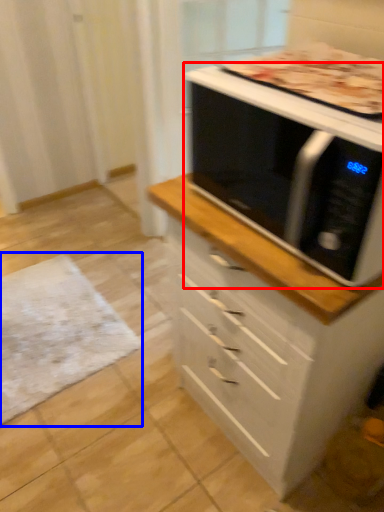
Question: Which object appears closest to the camera in this image, microwave oven (highlighted by a red box) or mat (highlighted by a blue box)?

Choices:
 (A) microwave oven
 (B) mat

Answer: (A)